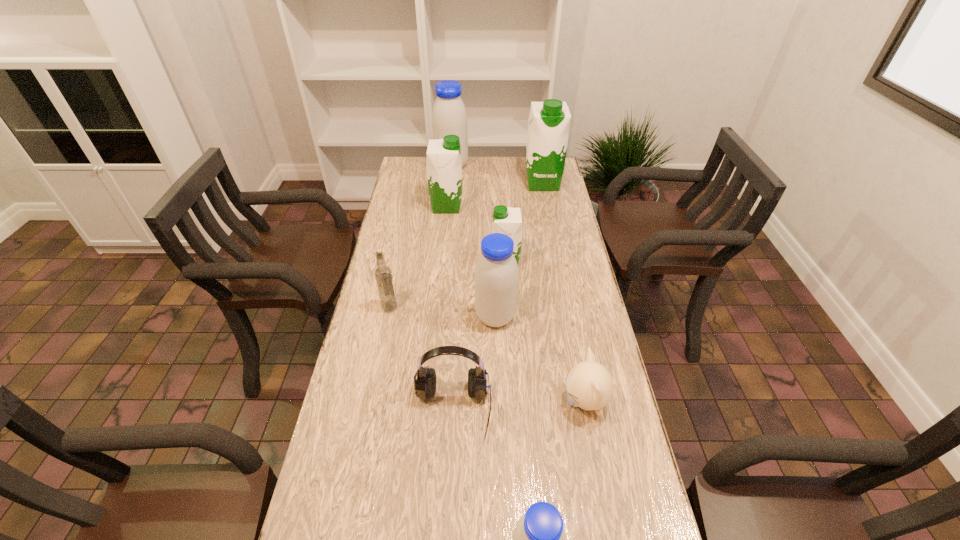
The image size is (960, 540). Identify the location of the farthest blue soya milk. click(449, 117).

I want to click on the biggest blue soya milk, so click(x=449, y=117).

I want to click on the farthest green soya milk, so click(549, 122).

Locate an element on the screen. This screenshot has height=540, width=960. the rightmost soya milk is located at coordinates [549, 122].

Identify the location of the second biggest green soya milk. Image resolution: width=960 pixels, height=540 pixels. (443, 158).

Where is `the seventh nearest object`? the seventh nearest object is located at coordinates (443, 158).

Where is `the second biggest blue soya milk`? Image resolution: width=960 pixels, height=540 pixels. the second biggest blue soya milk is located at coordinates (496, 275).

This screenshot has width=960, height=540. In order to click on the second nearest blue soya milk in this screenshot , I will do `click(496, 275)`.

The image size is (960, 540). In order to click on the leftmost object in this screenshot , I will do `click(383, 274)`.

Locate an element on the screen. This screenshot has width=960, height=540. the sixth nearest object is located at coordinates (506, 220).